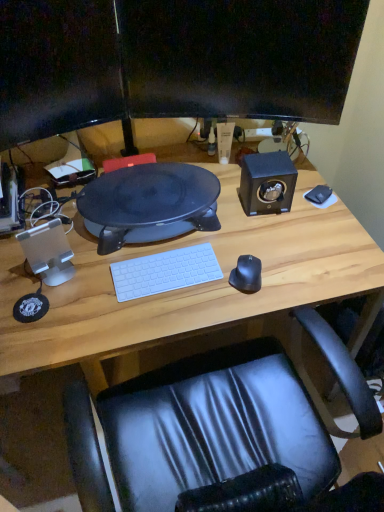
Where is `free space in front of black plastic computer at center`? The width and height of the screenshot is (384, 512). free space in front of black plastic computer at center is located at coordinates (132, 298).